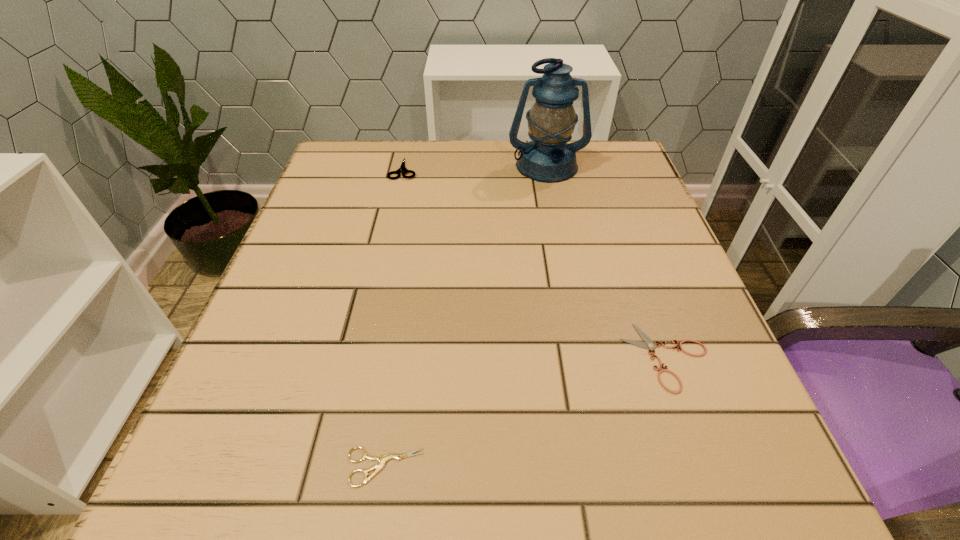
At what (x,y) coordinates should I click in order to perform the action: click on vacant space that satisfies the following two spatial constraints: 1. on the face of the rightmost shears; 2. on the right side of the lantern. Please return your answer as a coordinate pair (x, y). Looking at the image, I should click on (586, 356).

Find the location of a particular element. The image size is (960, 540). free spot that satisfies the following two spatial constraints: 1. on the face of the rightmost shears; 2. on the left side of the tallest object is located at coordinates (586, 356).